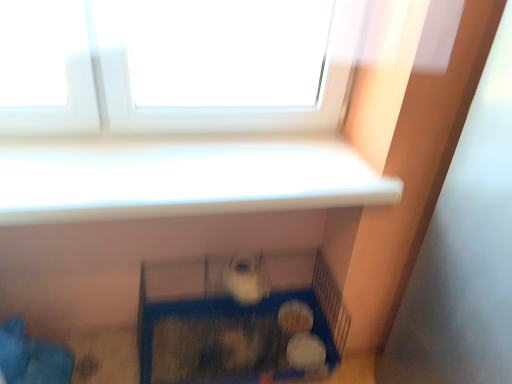
Where is `white fluffy ball at lower center, marked as the 2th animal in a back-to-front arrangement`? The height and width of the screenshot is (384, 512). white fluffy ball at lower center, marked as the 2th animal in a back-to-front arrangement is located at coordinates (305, 351).

Considering the sizes of objects white fur at center, the 1th animal viewed from the top, and white fluffy ball at lower center, which is counted as the 3th animal, starting from the front, in the image provided, who is bigger, white fur at center, the 1th animal viewed from the top, or white fluffy ball at lower center, which is counted as the 3th animal, starting from the front,?

Bigger between the two is white fur at center, the 1th animal viewed from the top.

Is white fur at center, placed as the 1th animal when sorted from front to back, next to white fluffy ball at lower center, which ranks as the second animal in top-to-bottom order?

They are not placed beside each other.

From the image's perspective, is white fur at center, placed as the 1th animal when sorted from front to back, beneath white fluffy ball at lower center, which appears as the 2th animal when ordered from the bottom?

No, from the image's perspective, white fur at center, placed as the 1th animal when sorted from front to back, is not below white fluffy ball at lower center, which appears as the 2th animal when ordered from the bottom.

Based on the photo, based on their positions, is white fluffy ball at lower center, which ranks as the second animal in top-to-bottom order, located to the left or right of white fluffy ball at lower center, the third animal in the top-to-bottom sequence?

From the image, it's evident that white fluffy ball at lower center, which ranks as the second animal in top-to-bottom order, is to the left of white fluffy ball at lower center, the third animal in the top-to-bottom sequence.

From the image's perspective, is white fluffy ball at lower center, which is counted as the 3th animal, starting from the front, on top of white fluffy ball at lower center, positioned as the second animal in front-to-back order?

Yes, from the image's perspective, white fluffy ball at lower center, which is counted as the 3th animal, starting from the front, is over white fluffy ball at lower center, positioned as the second animal in front-to-back order.

Looking at their sizes, would you say white fluffy ball at lower center, the first animal in the back-to-front sequence, is wider or thinner than white fluffy ball at lower center, marked as the 2th animal in a back-to-front arrangement?

In the image, white fluffy ball at lower center, the first animal in the back-to-front sequence, appears to be wider than white fluffy ball at lower center, marked as the 2th animal in a back-to-front arrangement.

Is white fluffy ball at lower center, which ranks as the second animal in top-to-bottom order, outside of white fluffy ball at lower center, placed as the first animal when sorted from bottom to top?

Indeed, white fluffy ball at lower center, which ranks as the second animal in top-to-bottom order, is completely outside white fluffy ball at lower center, placed as the first animal when sorted from bottom to top.

Is point (309, 340) closer or farther from the camera than point (290, 330)?

Point (309, 340) is positioned closer to the camera compared to point (290, 330).

Considering the sizes of white fluffy ball at lower center, marked as the 2th animal in a back-to-front arrangement, and white fluffy ball at lower center, which is counted as the 3th animal, starting from the front, in the image, is white fluffy ball at lower center, marked as the 2th animal in a back-to-front arrangement, taller or shorter than white fluffy ball at lower center, which is counted as the 3th animal, starting from the front,?

Considering their sizes, white fluffy ball at lower center, marked as the 2th animal in a back-to-front arrangement, has less height than white fluffy ball at lower center, which is counted as the 3th animal, starting from the front.

What are the coordinates of `animal behind the white fluffy ball at lower center, the third animal in the top-to-bottom sequence` in the screenshot? It's located at (295, 317).

Where is `the 2nd animal positioned below the blue plastic cage at lower center (from the image's perspective)`? The height and width of the screenshot is (384, 512). the 2nd animal positioned below the blue plastic cage at lower center (from the image's perspective) is located at coordinates (305, 351).

Is white fluffy ball at lower center, the third animal in the top-to-bottom sequence, behind blue plastic cage at lower center?

Yes, white fluffy ball at lower center, the third animal in the top-to-bottom sequence, is further from the viewer.

Is white fluffy ball at lower center, positioned as the second animal in front-to-back order, taller or shorter than blue plastic cage at lower center?

In the image, white fluffy ball at lower center, positioned as the second animal in front-to-back order, appears to be shorter than blue plastic cage at lower center.

Could you tell me if blue plastic cage at lower center is turned towards white fluffy ball at lower center, which is counted as the 3th animal, starting from the front?

No, blue plastic cage at lower center is not facing towards white fluffy ball at lower center, which is counted as the 3th animal, starting from the front.

Looking at this image, which object is wider, blue plastic cage at lower center or white fluffy ball at lower center, which is counted as the 3th animal, starting from the front?

With larger width is blue plastic cage at lower center.

What's the angular difference between blue plastic cage at lower center and white fluffy ball at lower center, which is counted as the 3th animal, starting from the front,'s facing directions?

blue plastic cage at lower center and white fluffy ball at lower center, which is counted as the 3th animal, starting from the front, are facing 2.64e-05 degrees away from each other.

I want to click on the 1st animal located beneath the blue plastic cage at lower center (from a real-world perspective), so click(x=295, y=317).

In terms of height, does blue plastic cage at lower center look taller or shorter compared to white fur at center, placed as the 1th animal when sorted from front to back?

In the image, blue plastic cage at lower center appears to be taller than white fur at center, placed as the 1th animal when sorted from front to back.

Is blue plastic cage at lower center not close to white fur at center, placed as the 1th animal when sorted from front to back?

No, there isn't a large distance between blue plastic cage at lower center and white fur at center, placed as the 1th animal when sorted from front to back.

Is point (147, 293) closer or farther from the camera than point (228, 288)?

Clearly, point (147, 293) is more distant from the camera than point (228, 288).

Considering the positions of objects blue plastic cage at lower center and white fur at center, placed as the 1th animal when sorted from front to back, in the image provided, who is in front, blue plastic cage at lower center or white fur at center, placed as the 1th animal when sorted from front to back,?

blue plastic cage at lower center is in front.

Based on the photo, does white fur at center, placed as the 1th animal when sorted from front to back, have a greater height compared to blue plastic cage at lower center?

In fact, white fur at center, placed as the 1th animal when sorted from front to back, may be shorter than blue plastic cage at lower center.

Which is more to the right, white fur at center, the 1th animal viewed from the top, or blue plastic cage at lower center?

Positioned to the right is white fur at center, the 1th animal viewed from the top.

Does white fur at center, positioned as the 3th animal in bottom-to-top order, turn towards blue plastic cage at lower center?

No, white fur at center, positioned as the 3th animal in bottom-to-top order, is not turned towards blue plastic cage at lower center.

Could you measure the distance between white fur at center, placed as the 1th animal when sorted from front to back, and blue plastic cage at lower center?

A distance of 8.43 inches exists between white fur at center, placed as the 1th animal when sorted from front to back, and blue plastic cage at lower center.

You are a GUI agent. You are given a task and a screenshot of the screen. Output one action in this format:
    pyautogui.click(x=<x>, y=<y>)
    Task: Click on the 2nd animal behind when counting from the white fur at center, positioned as the 3th animal in bottom-to-top order
    This screenshot has width=512, height=384.
    Given the screenshot: What is the action you would take?
    pyautogui.click(x=295, y=317)

You are a GUI agent. You are given a task and a screenshot of the screen. Output one action in this format:
    pyautogui.click(x=<x>, y=<y>)
    Task: Click on the 1st animal to the left of the white fluffy ball at lower center, marked as the 2th animal in a back-to-front arrangement, counting from the anchor's position
    The width and height of the screenshot is (512, 384).
    Given the screenshot: What is the action you would take?
    pyautogui.click(x=295, y=317)

Estimate the real-world distances between objects in this image. Which object is further from white fur at center, the 1th animal viewed from the top, white fluffy ball at lower center, which is counted as the 3th animal, starting from the front, or blue plastic cage at lower center?

Among the two, white fluffy ball at lower center, which is counted as the 3th animal, starting from the front, is located further to white fur at center, the 1th animal viewed from the top.

Looking at the image, which one is located further to white fur at center, placed as the 1th animal when sorted from front to back, white fluffy ball at lower center, the third animal in the top-to-bottom sequence, or white fluffy ball at lower center, the first animal in the back-to-front sequence?

white fluffy ball at lower center, the third animal in the top-to-bottom sequence, lies further to white fur at center, placed as the 1th animal when sorted from front to back, than the other object.

Based on their spatial positions, is blue plastic cage at lower center or white fur at center, the 1th animal viewed from the top, closer to white fluffy ball at lower center, which ranks as the second animal in top-to-bottom order?

blue plastic cage at lower center is positioned closer to the anchor white fluffy ball at lower center, which ranks as the second animal in top-to-bottom order.

When comparing their distances from blue plastic cage at lower center, does white fur at center, positioned as the 3th animal in bottom-to-top order, or white fluffy ball at lower center, which ranks as the second animal in top-to-bottom order, seem further?

white fluffy ball at lower center, which ranks as the second animal in top-to-bottom order, lies further to blue plastic cage at lower center than the other object.

Estimate the real-world distances between objects in this image. Which object is further from white fluffy ball at lower center, placed as the first animal when sorted from bottom to top, white fluffy ball at lower center, which is counted as the 3th animal, starting from the front, or blue plastic cage at lower center?

blue plastic cage at lower center.

From the image, which object appears to be farther from blue plastic cage at lower center, white fur at center, the 1th animal viewed from the top, or white fluffy ball at lower center, marked as the 2th animal in a back-to-front arrangement?

white fluffy ball at lower center, marked as the 2th animal in a back-to-front arrangement, is positioned further to the anchor blue plastic cage at lower center.

Based on their spatial positions, is white fur at center, the 1th animal viewed from the top, or blue plastic cage at lower center closer to white fluffy ball at lower center, which appears as the 2th animal when ordered from the bottom?

blue plastic cage at lower center lies closer to white fluffy ball at lower center, which appears as the 2th animal when ordered from the bottom, than the other object.

Which object lies further to the anchor point white fluffy ball at lower center, the third animal in the top-to-bottom sequence, blue plastic cage at lower center or white fluffy ball at lower center, which is counted as the 3th animal, starting from the front?

Among the two, blue plastic cage at lower center is located further to white fluffy ball at lower center, the third animal in the top-to-bottom sequence.

At what (x,y) coordinates should I click in order to perform the action: click on animal located between blue plastic cage at lower center and white fluffy ball at lower center, positioned as the second animal in front-to-back order, in the depth direction. Please return your answer as a coordinate pair (x, y). Looking at the image, I should click on (246, 278).

You are a GUI agent. You are given a task and a screenshot of the screen. Output one action in this format:
    pyautogui.click(x=<x>, y=<y>)
    Task: Click on the animal between white fur at center, which is the third animal in back-to-front order, and white fluffy ball at lower center, the first animal in the back-to-front sequence, in the front-back direction
    This screenshot has height=384, width=512.
    Given the screenshot: What is the action you would take?
    pyautogui.click(x=305, y=351)